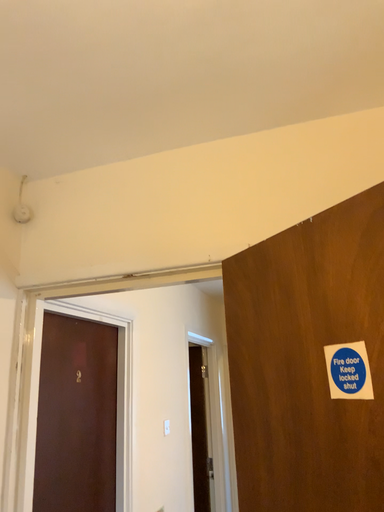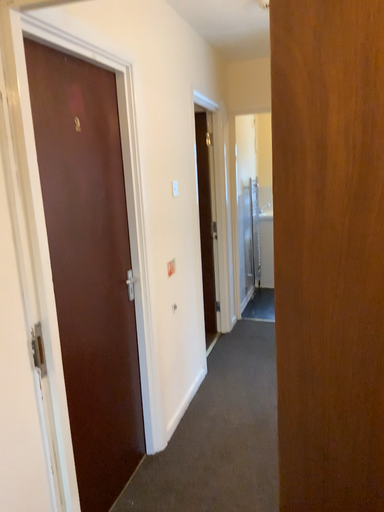
Question: How did the camera likely rotate when shooting the video?

Choices:
 (A) rotated downward
 (B) rotated upward

Answer: (A)